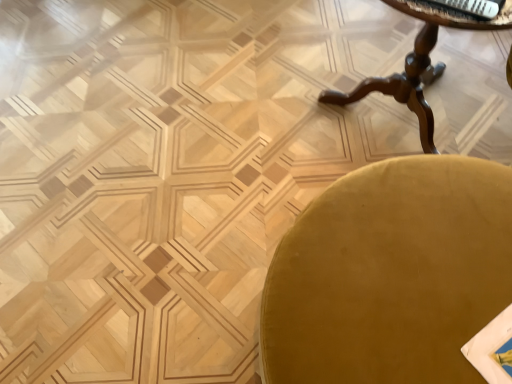
Identify the location of free spot below mahogany wood table at upper right (from a real-world perspective). The width and height of the screenshot is (512, 384). (391, 120).